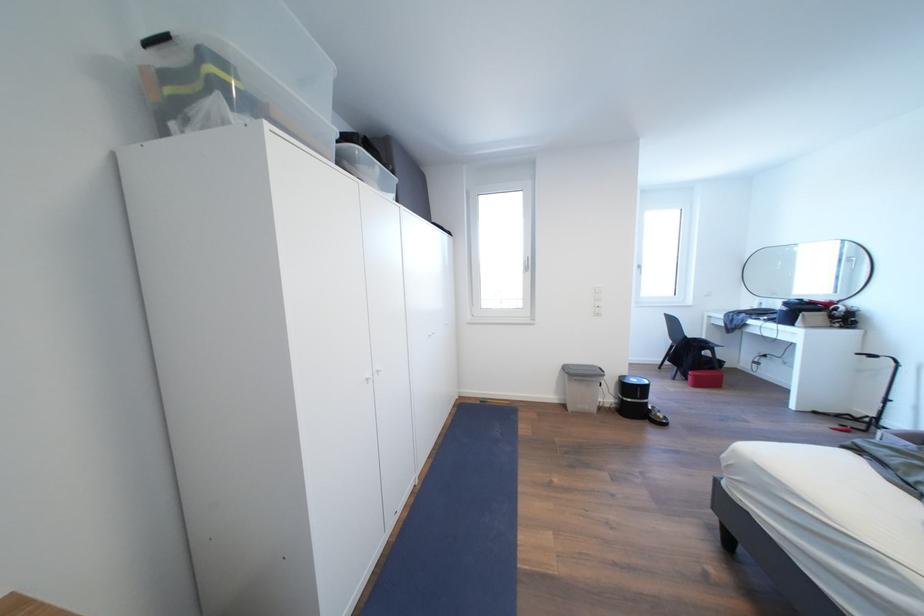
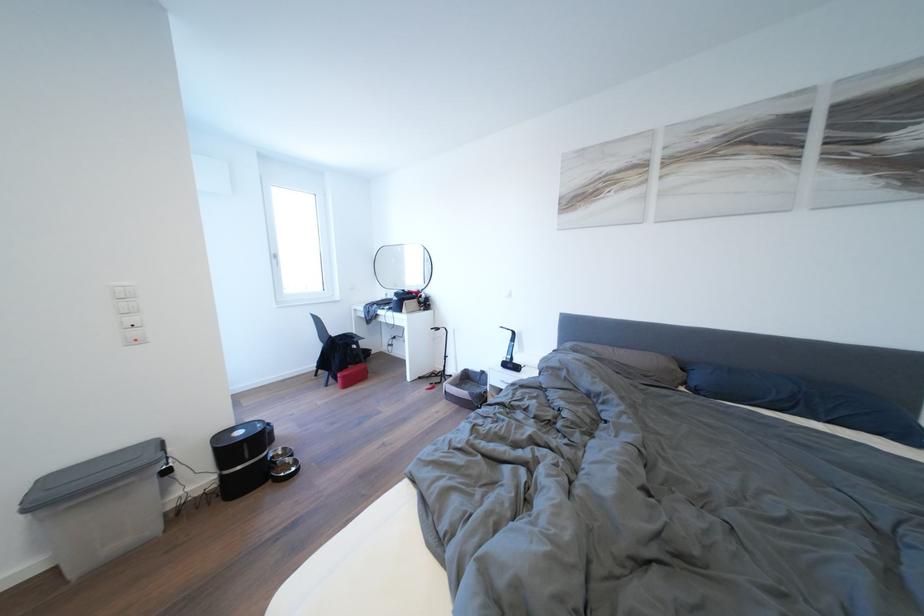
Locate, in the second image, the point that corresponds to pixel 641 386 in the first image.

(248, 438)